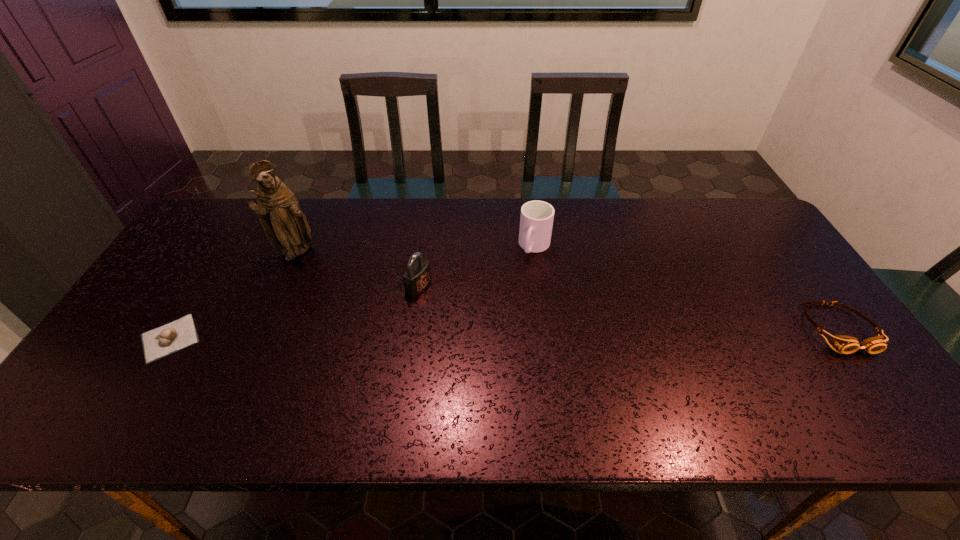
Find the location of a particular element. vacant space on the desktop that is between the shortest object and the rightmost object and is positioned on the front of the third object from right to left near the keyhole is located at coordinates (516, 333).

You are a GUI agent. You are given a task and a screenshot of the screen. Output one action in this format:
    pyautogui.click(x=<x>, y=<y>)
    Task: Click on the free space on the desktop that is between the garlic and the goggles and is positioned on the front-facing side of the figurine
    The image size is (960, 540).
    Given the screenshot: What is the action you would take?
    pyautogui.click(x=447, y=334)

The width and height of the screenshot is (960, 540). I want to click on vacant spot on the desktop that is between the shortest object and the goggles and is positioned with the handle on the side of the cup, so click(493, 334).